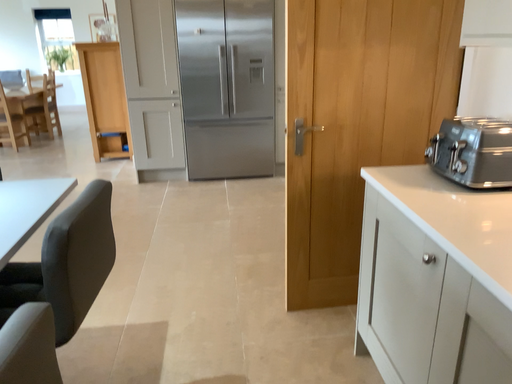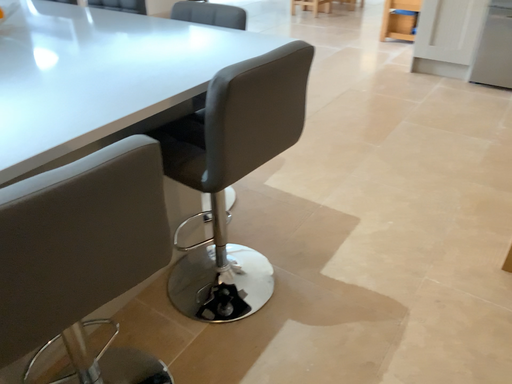
Question: Which way did the camera rotate in the video?

Choices:
 (A) rotated right
 (B) rotated left

Answer: (B)